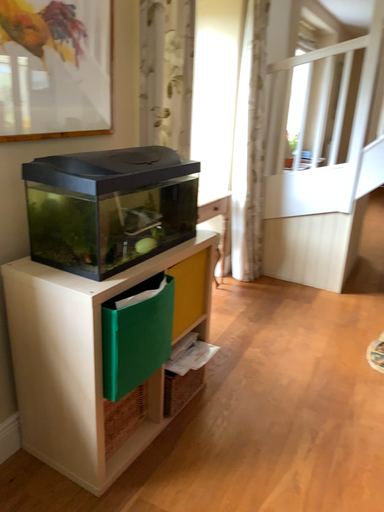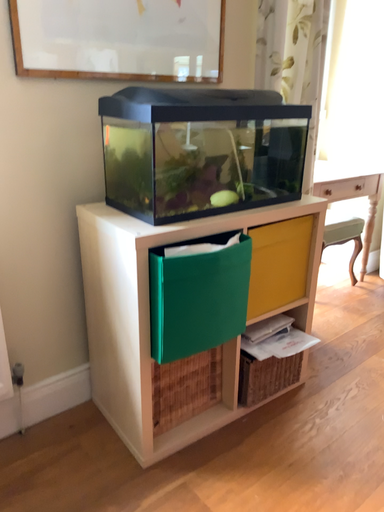
Question: How did the camera likely rotate when shooting the video?

Choices:
 (A) rotated right
 (B) rotated left

Answer: (B)